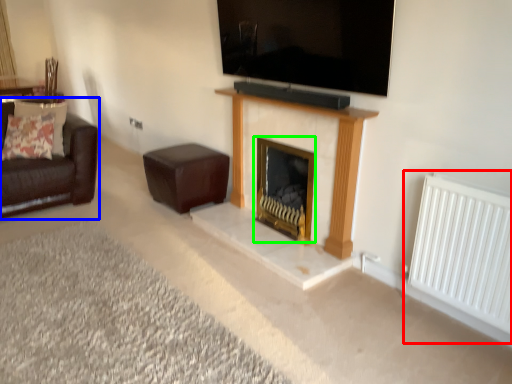
Question: Which is farther away from radiator (highlighted by a red box)? studio couch (highlighted by a blue box) or fireplace (highlighted by a green box)?

Choices:
 (A) studio couch
 (B) fireplace

Answer: (A)